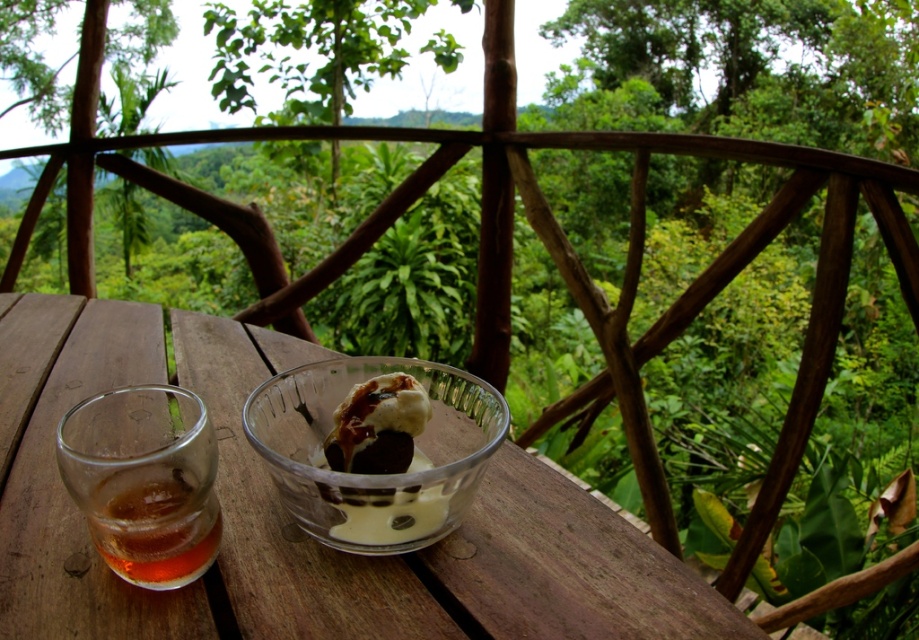
You are a server at a cafe and need to deliver the amber liquid glass at left and the translucent glass bowl at center to a customer seated at the table. The customer asks which item is closer to the edge of the table. Based on the scene, which one should you point out?

The amber liquid glass at left is closer to the edge of the table since it is positioned to the left of the translucent glass bowl at center, which is centrally located.

You are standing on the balcony and want to reach both points in the scene. Which point, point (63, 580) or point (372, 436), will you reach first if you move directly towards them?

Point (63, 580) is closer to the camera than point (372, 436), so you will reach point (63, 580) first.

You are standing on the balcony and want to grab the amber liquid glass at left to drink. To reach it, you need to walk around the transparent glass table at center. Which direction should you move relative to the table to get to the glass?

The amber liquid glass at left is behind the transparent glass table at center, so you should move behind the transparent glass table at center to reach it.